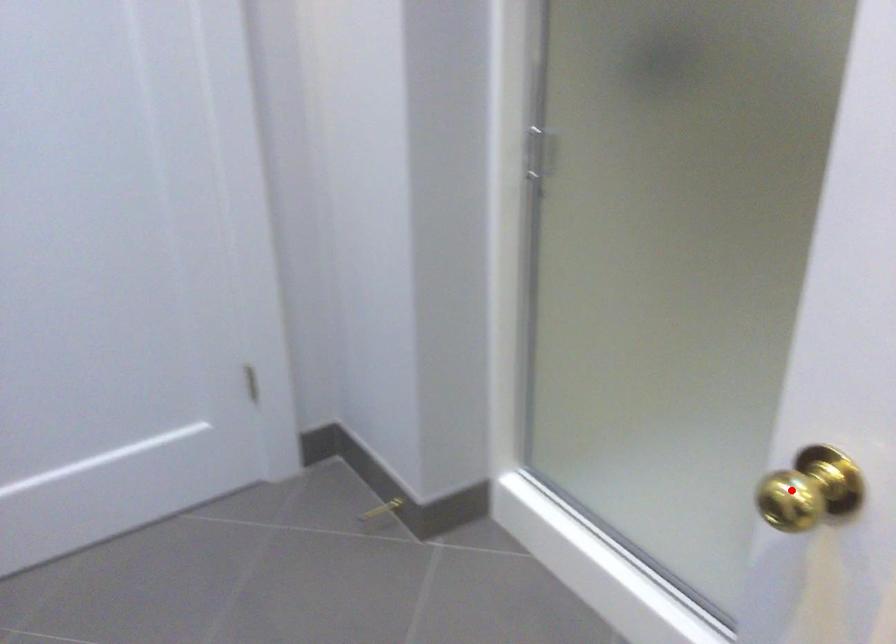
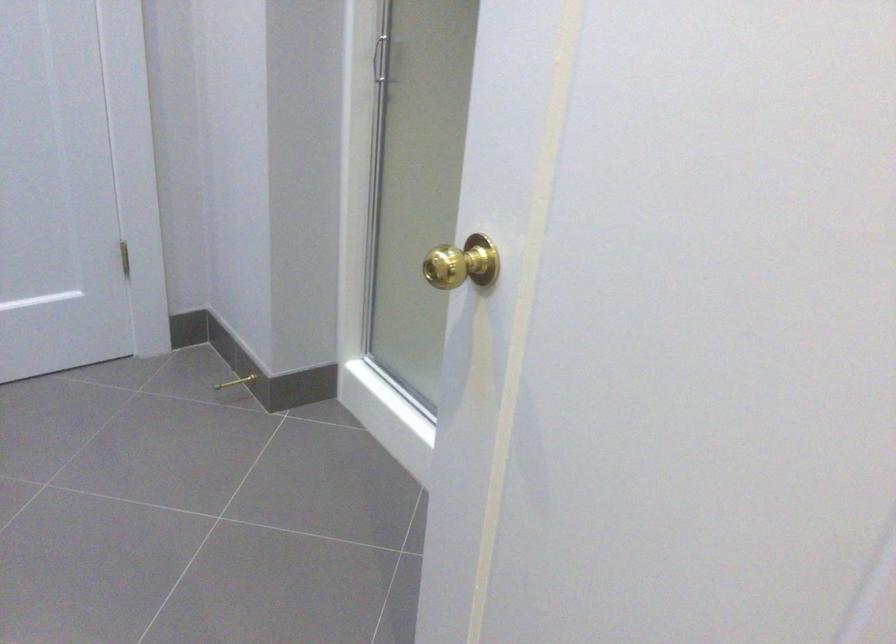
The point at the highlighted location is marked in the first image. Where is the corresponding point in the second image?

(461, 263)